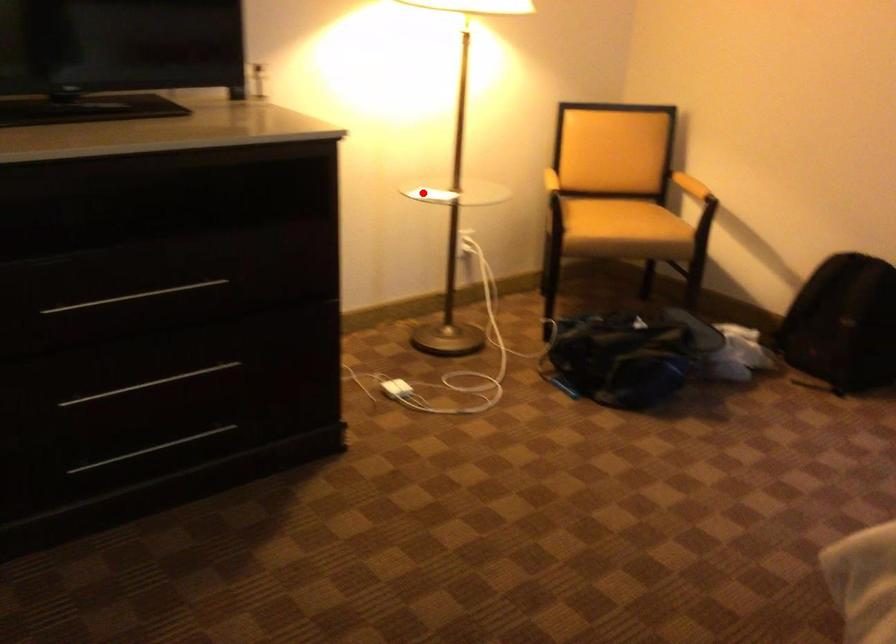
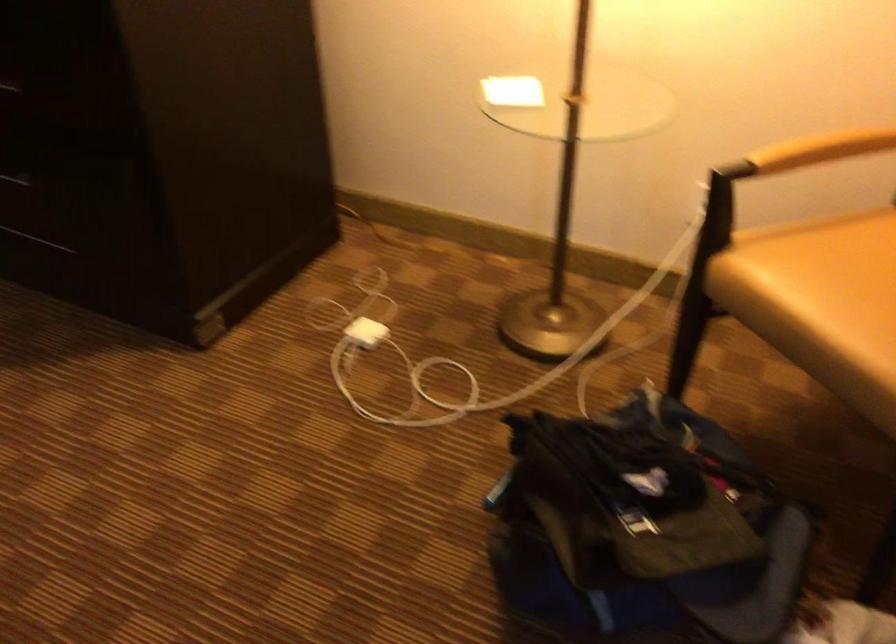
The point at the highlighted location is marked in the first image. Where is the corresponding point in the second image?

(513, 91)